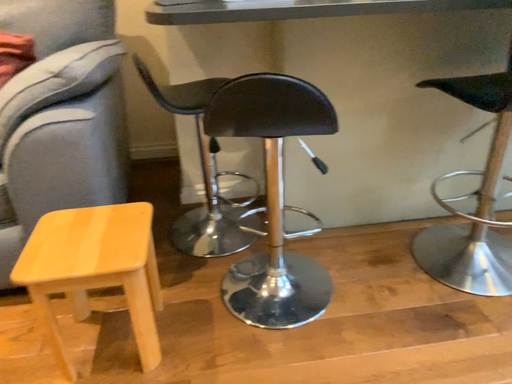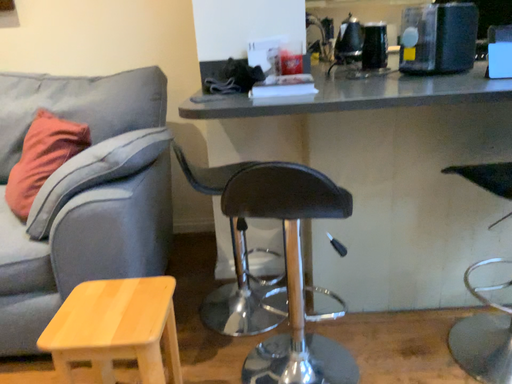
Question: Which way did the camera rotate in the video?

Choices:
 (A) rotated right
 (B) rotated left

Answer: (B)